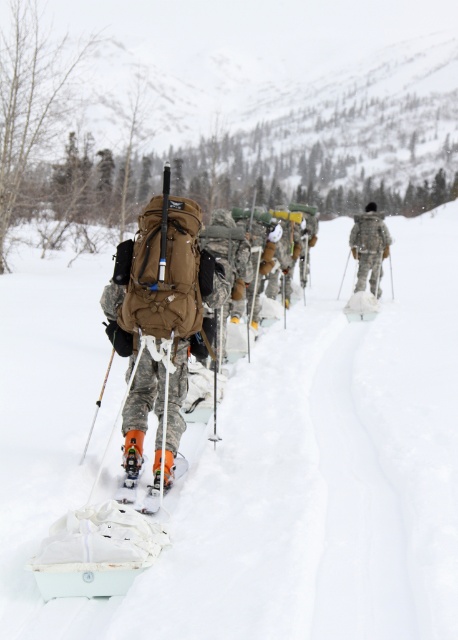
Locate an element on the screen. camouflage fabric uniform at center is located at coordinates (369, 246).

From the picture: Does camouflage fabric uniform at center appear over orange matte ski at center?

Yes, camouflage fabric uniform at center is above orange matte ski at center.

Which is behind, point (381, 241) or point (146, 499)?

The point (381, 241) is behind.

The width and height of the screenshot is (458, 640). In order to click on camouflage fabric uniform at center in this screenshot , I will do `click(369, 246)`.

Is white matte snow at center smaller than orange matte ski at center?

Incorrect, white matte snow at center is not smaller in size than orange matte ski at center.

Can you confirm if white matte snow at center is thinner than orange matte ski at center?

No.

Who is more forward, (424, 248) or (165, 449)?

Point (165, 449)

I want to click on white matte snow at center, so click(256, 460).

Is white matte snow at center behind camouflage fabric backpack at center?

No.

Can you confirm if white matte snow at center is bigger than camouflage fabric backpack at center?

Indeed, white matte snow at center has a larger size compared to camouflage fabric backpack at center.

Is point (358, 568) in front of point (201, 282)?

Yes.

I want to click on white matte snow at center, so click(x=256, y=460).